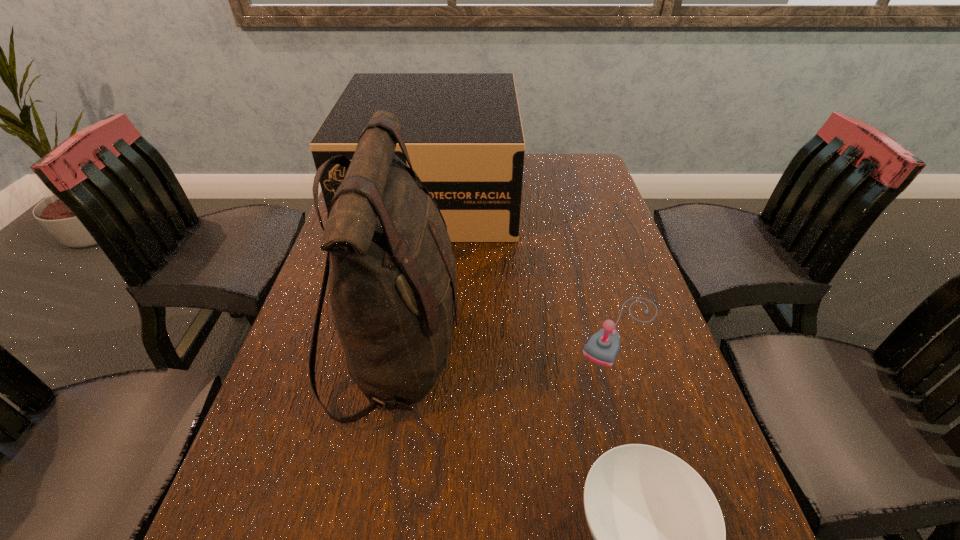
I want to click on the tallest object, so click(x=392, y=275).

Find the location of a particular element. the farthest object is located at coordinates (463, 133).

At what (x,y) coordinates should I click in order to perform the action: click on the second tallest object. Please return your answer as a coordinate pair (x, y). Looking at the image, I should click on click(463, 133).

Where is `joystick`? This screenshot has height=540, width=960. joystick is located at coordinates tap(603, 347).

At what (x,y) coordinates should I click in order to perform the action: click on free spot located on the open flap of the backpack. Please return your answer as a coordinate pair (x, y). The height and width of the screenshot is (540, 960). Looking at the image, I should click on (564, 352).

You are a GUI agent. You are given a task and a screenshot of the screen. Output one action in this format:
    pyautogui.click(x=<x>, y=<y>)
    Task: Click on the free location located on the front-facing side of the farthest object
    The height and width of the screenshot is (540, 960).
    Given the screenshot: What is the action you would take?
    pyautogui.click(x=417, y=312)

Find the location of a particular element. This screenshot has height=540, width=960. vacant region located on the back of the joystick is located at coordinates (584, 211).

Where is `object at the far edge`? Image resolution: width=960 pixels, height=540 pixels. object at the far edge is located at coordinates (463, 133).

Locate an element on the screen. backpack that is at the left edge is located at coordinates (392, 275).

Identify the location of box that is at the left edge. (463, 133).